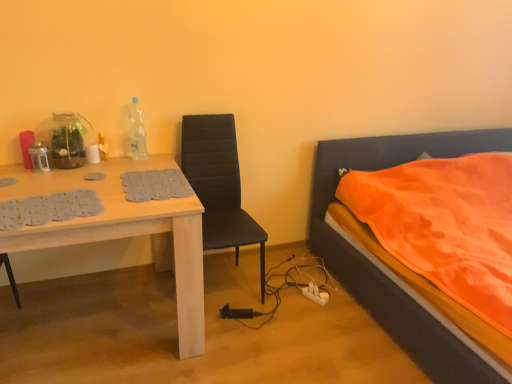
Find the location of a particular element. The width and height of the screenshot is (512, 384). unoccupied region to the right of light wood table at left is located at coordinates (268, 330).